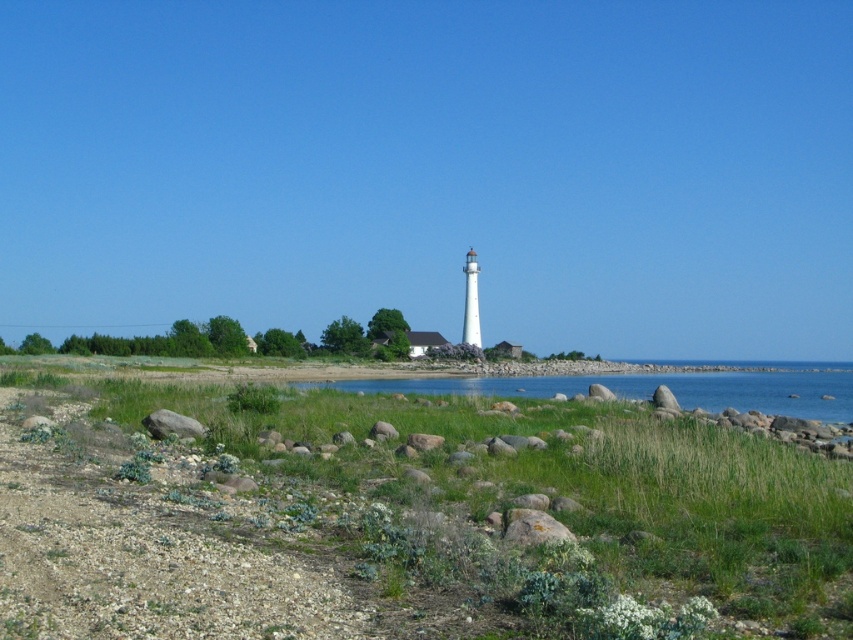
You are standing at the lighthouse in the center of the scene. Looking towards the blue water at center, which direction should you face?

You should face the direction where the blue water at center is located, which is at point coordinates (651, 388). Since the lighthouse is in the center, facing towards the blue water at center would mean facing towards the coordinates provided.

You are standing at the lighthouse and want to walk to the point marked at coordinates point (x=798, y=364) and point (x=171, y=422). Which point should you reach first?

You should reach point (x=798, y=364) first because it is closer to you than point (x=171, y=422), which is further away.

You are standing at the point marked as point (x=651, y=388) in the coastal landscape. What do you see directly in front of you?

At point (x=651, y=388), you see blue water at center directly in front of you.